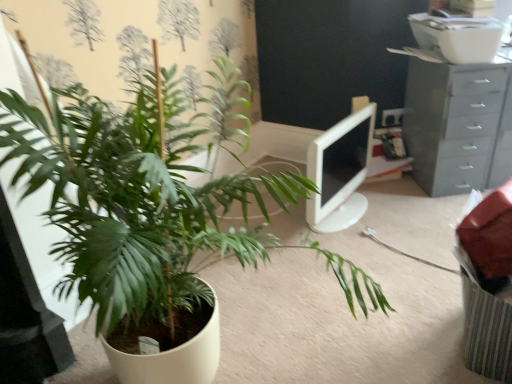
Question: Can you confirm if green matte plant at center-left is positioned to the right of white glossy monitor at center?

Choices:
 (A) yes
 (B) no

Answer: (B)

Question: From a real-world perspective, is green matte plant at center-left on white glossy monitor at center?

Choices:
 (A) no
 (B) yes

Answer: (B)

Question: Considering the relative sizes of green matte plant at center-left and white glossy monitor at center in the image provided, is green matte plant at center-left wider than white glossy monitor at center?

Choices:
 (A) yes
 (B) no

Answer: (A)

Question: Is green matte plant at center-left touching white glossy monitor at center?

Choices:
 (A) yes
 (B) no

Answer: (B)

Question: Does green matte plant at center-left have a lesser width compared to white glossy monitor at center?

Choices:
 (A) yes
 (B) no

Answer: (B)

Question: From their relative heights in the image, would you say white glossy monitor at center is taller or shorter than green matte plant at center-left?

Choices:
 (A) short
 (B) tall

Answer: (A)

Question: Visually, is white glossy monitor at center positioned to the left or to the right of green matte plant at center-left?

Choices:
 (A) left
 (B) right

Answer: (B)

Question: Considering their positions, is white glossy monitor at center located in front of or behind green matte plant at center-left?

Choices:
 (A) front
 (B) behind

Answer: (B)

Question: Is point (323, 162) closer or farther from the camera than point (349, 284)?

Choices:
 (A) farther
 (B) closer

Answer: (A)

Question: Do you think white glossy monitor at center is within gray plastic chest of drawers at upper right, or outside of it?

Choices:
 (A) outside
 (B) inside

Answer: (A)

Question: Is point (358, 148) closer or farther from the camera than point (435, 89)?

Choices:
 (A) farther
 (B) closer

Answer: (A)

Question: From the image's perspective, is white glossy monitor at center positioned above or below gray plastic chest of drawers at upper right?

Choices:
 (A) below
 (B) above

Answer: (A)

Question: From a real-world perspective, is white glossy monitor at center positioned above or below gray plastic chest of drawers at upper right?

Choices:
 (A) below
 (B) above

Answer: (A)

Question: Is gray plastic chest of drawers at upper right in front of or behind green matte plant at center-left in the image?

Choices:
 (A) front
 (B) behind

Answer: (B)

Question: From the image's perspective, relative to green matte plant at center-left, is gray plastic chest of drawers at upper right above or below?

Choices:
 (A) above
 (B) below

Answer: (A)